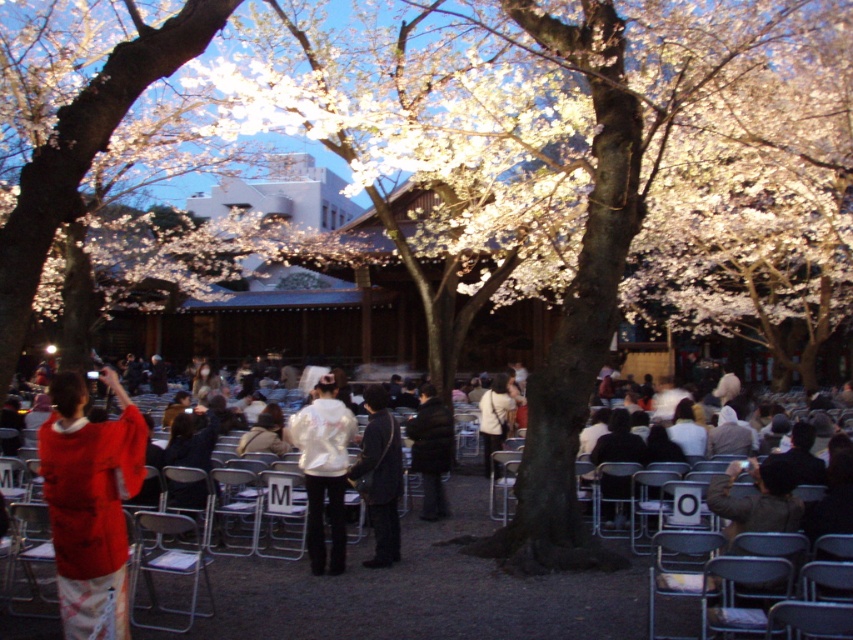
Who is taller, red fabric kimono at left or dark gray suit at center?

Standing taller between the two is dark gray suit at center.

Is red fabric kimono at left above dark gray suit at center?

No, red fabric kimono at left is not above dark gray suit at center.

Where is `red fabric kimono at left`? Image resolution: width=853 pixels, height=640 pixels. red fabric kimono at left is located at coordinates (425, 589).

Which of these two, dark gray suit at center or metallic gray chair at lower right, stands taller?

With more height is dark gray suit at center.

Does dark gray suit at center have a lesser width compared to metallic gray chair at lower right?

Indeed, dark gray suit at center has a lesser width compared to metallic gray chair at lower right.

This screenshot has height=640, width=853. I want to click on dark gray suit at center, so click(x=380, y=476).

Can you confirm if metallic silver chair at lower left is positioned above black matte jacket at center?

Actually, metallic silver chair at lower left is below black matte jacket at center.

Between point (151, 579) and point (437, 400), which one is positioned behind?

Positioned behind is point (437, 400).

I want to click on metallic silver chair at lower left, so click(x=167, y=563).

This screenshot has width=853, height=640. In order to click on metallic silver chair at lower left in this screenshot , I will do `click(167, 563)`.